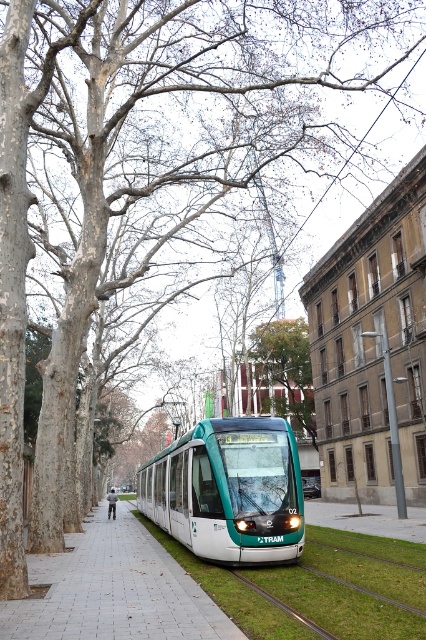
Measure the distance from teal glossy tram at center to white tile pavement at center.

They are 2.00 meters apart.

Is teal glossy tram at center further to camera compared to white tile pavement at center?

Yes, it is.

Is point (199, 470) farther from viewer compared to point (13, 628)?

Yes, it is behind point (13, 628).

The width and height of the screenshot is (426, 640). I want to click on teal glossy tram at center, so click(x=229, y=490).

Is white tile pavement at center bigger than green matte coach at center?

Incorrect, white tile pavement at center is not larger than green matte coach at center.

Does white tile pavement at center lie behind green matte coach at center?

No, white tile pavement at center is closer to the viewer.

Who is more distant from viewer, (x=85, y=576) or (x=111, y=497)?

The point (x=111, y=497) is behind.

Where is `white tile pavement at center`? This screenshot has width=426, height=640. white tile pavement at center is located at coordinates (114, 589).

Does teal glossy tram at center lie behind green matte coach at center?

No, teal glossy tram at center is in front of green matte coach at center.

Is teal glossy tram at center thinner than green matte coach at center?

Correct, teal glossy tram at center's width is less than green matte coach at center's.

Is point (146, 467) positioned in front of point (111, 506)?

No, (146, 467) is further to viewer.

Image resolution: width=426 pixels, height=640 pixels. Identify the location of teal glossy tram at center. (229, 490).